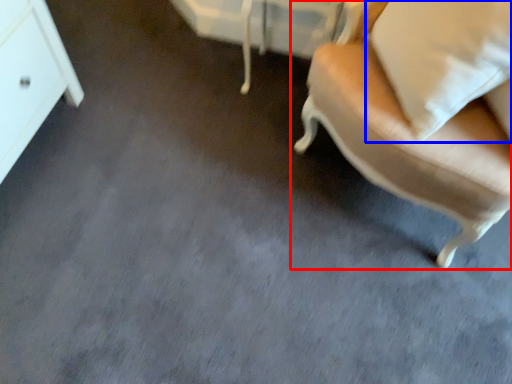
Question: Which of the following is the farthest to the observer, chair (highlighted by a red box) or pillow (highlighted by a blue box)?

Choices:
 (A) chair
 (B) pillow

Answer: (B)